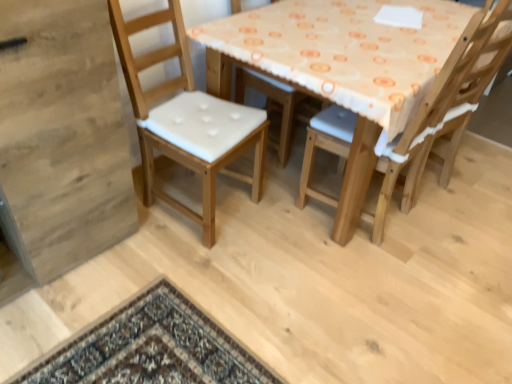
This screenshot has width=512, height=384. What do you see at coordinates (186, 118) in the screenshot? I see `light brown wood chair at left, the first chair when ordered from left to right` at bounding box center [186, 118].

Where is `light brown wood chair at left, the first chair when ordered from left to right`? light brown wood chair at left, the first chair when ordered from left to right is located at coordinates (186, 118).

How much space does light brown wood chair at left, acting as the second chair starting from the right, occupy vertically?

light brown wood chair at left, acting as the second chair starting from the right, is 3.37 feet in height.

How much space does light brown wood chair at left, the first chair when ordered from left to right, occupy horizontally?

The width of light brown wood chair at left, the first chair when ordered from left to right, is 53.26 centimeters.

Locate an element on the screen. This screenshot has height=384, width=512. wooden chair with white cushion at center, acting as the 2th chair starting from the left is located at coordinates (442, 107).

Describe the element at coordinates (442, 107) in the screenshot. I see `wooden chair with white cushion at center, which is counted as the first chair, starting from the right` at that location.

Where is `light brown wood chair at left, acting as the second chair starting from the right`? The image size is (512, 384). light brown wood chair at left, acting as the second chair starting from the right is located at coordinates (186, 118).

Is light brown wood chair at left, the first chair when ordered from left to right, to the left of wooden chair with white cushion at center, acting as the 2th chair starting from the left, from the viewer's perspective?

Yes.

Which object is closer to the camera, light brown wood chair at left, the first chair when ordered from left to right, or wooden chair with white cushion at center, acting as the 2th chair starting from the left?

light brown wood chair at left, the first chair when ordered from left to right, is closer to the camera.

Does point (205, 187) appear closer or farther from the camera than point (436, 133)?

Point (205, 187) appears to be closer to the viewer than point (436, 133).

From the image's perspective, which is below, light brown wood chair at left, the first chair when ordered from left to right, or wooden chair with white cushion at center, which is counted as the first chair, starting from the right?

From the image's view, wooden chair with white cushion at center, which is counted as the first chair, starting from the right, is below.

From a real-world perspective, is light brown wood chair at left, the first chair when ordered from left to right, positioned over wooden chair with white cushion at center, acting as the 2th chair starting from the left, based on gravity?

No, from a real-world perspective, light brown wood chair at left, the first chair when ordered from left to right, is not on top of wooden chair with white cushion at center, acting as the 2th chair starting from the left.

Consider the image. Which of these two, light brown wood chair at left, the first chair when ordered from left to right, or wooden chair with white cushion at center, acting as the 2th chair starting from the left, is wider?

wooden chair with white cushion at center, acting as the 2th chair starting from the left, is wider.

Does light brown wood chair at left, the first chair when ordered from left to right, have a lesser height compared to wooden chair with white cushion at center, acting as the 2th chair starting from the left?

Correct, light brown wood chair at left, the first chair when ordered from left to right, is not as tall as wooden chair with white cushion at center, acting as the 2th chair starting from the left.

Looking at this image, between light brown wood chair at left, the first chair when ordered from left to right, and wooden chair with white cushion at center, acting as the 2th chair starting from the left, which one has smaller size?

wooden chair with white cushion at center, acting as the 2th chair starting from the left.

Is light brown wood chair at left, acting as the second chair starting from the right, surrounding wooden chair with white cushion at center, acting as the 2th chair starting from the left?

No, wooden chair with white cushion at center, acting as the 2th chair starting from the left, is located outside of light brown wood chair at left, acting as the second chair starting from the right.

Does light brown wood chair at left, the first chair when ordered from left to right, touch wooden chair with white cushion at center, acting as the 2th chair starting from the left?

There is a gap between light brown wood chair at left, the first chair when ordered from left to right, and wooden chair with white cushion at center, acting as the 2th chair starting from the left.

Does light brown wood chair at left, the first chair when ordered from left to right, turn towards wooden chair with white cushion at center, acting as the 2th chair starting from the left?

No.

Where is `chair below the light brown wood chair at left, the first chair when ordered from left to right (from the image's perspective)`? The width and height of the screenshot is (512, 384). chair below the light brown wood chair at left, the first chair when ordered from left to right (from the image's perspective) is located at coordinates (442, 107).

Can you confirm if wooden chair with white cushion at center, which is counted as the first chair, starting from the right, is positioned to the left of light brown wood chair at left, the first chair when ordered from left to right?

Incorrect, wooden chair with white cushion at center, which is counted as the first chair, starting from the right, is not on the left side of light brown wood chair at left, the first chair when ordered from left to right.

Considering the relative positions of wooden chair with white cushion at center, which is counted as the first chair, starting from the right, and light brown wood chair at left, the first chair when ordered from left to right, in the image provided, is wooden chair with white cushion at center, which is counted as the first chair, starting from the right, in front of light brown wood chair at left, the first chair when ordered from left to right,?

No, the depth of wooden chair with white cushion at center, which is counted as the first chair, starting from the right, is greater than that of light brown wood chair at left, the first chair when ordered from left to right.

Is point (422, 103) positioned after point (197, 151)?

No, (422, 103) is in front of (197, 151).

From the image's perspective, which object appears higher, wooden chair with white cushion at center, which is counted as the first chair, starting from the right, or light brown wood chair at left, the first chair when ordered from left to right?

light brown wood chair at left, the first chair when ordered from left to right, from the image's perspective.

From a real-world perspective, is wooden chair with white cushion at center, acting as the 2th chair starting from the left, positioned above or below light brown wood chair at left, acting as the second chair starting from the right?

wooden chair with white cushion at center, acting as the 2th chair starting from the left, is situated higher than light brown wood chair at left, acting as the second chair starting from the right, in the real world.

Can you confirm if wooden chair with white cushion at center, acting as the 2th chair starting from the left, is wider than light brown wood chair at left, acting as the second chair starting from the right?

Correct, the width of wooden chair with white cushion at center, acting as the 2th chair starting from the left, exceeds that of light brown wood chair at left, acting as the second chair starting from the right.

From their relative heights in the image, would you say wooden chair with white cushion at center, acting as the 2th chair starting from the left, is taller or shorter than light brown wood chair at left, acting as the second chair starting from the right?

wooden chair with white cushion at center, acting as the 2th chair starting from the left, is taller than light brown wood chair at left, acting as the second chair starting from the right.

Considering the relative sizes of wooden chair with white cushion at center, acting as the 2th chair starting from the left, and light brown wood chair at left, acting as the second chair starting from the right, in the image provided, is wooden chair with white cushion at center, acting as the 2th chair starting from the left, smaller than light brown wood chair at left, acting as the second chair starting from the right,?

Yes.

Is wooden chair with white cushion at center, which is counted as the first chair, starting from the right, situated inside light brown wood chair at left, the first chair when ordered from left to right, or outside?

The correct answer is: outside.

Is wooden chair with white cushion at center, which is counted as the first chair, starting from the right, directly adjacent to light brown wood chair at left, acting as the second chair starting from the right?

No, wooden chair with white cushion at center, which is counted as the first chair, starting from the right, is not with light brown wood chair at left, acting as the second chair starting from the right.

Could you tell me if wooden chair with white cushion at center, acting as the 2th chair starting from the left, is facing light brown wood chair at left, the first chair when ordered from left to right?

No, wooden chair with white cushion at center, acting as the 2th chair starting from the left, is not oriented towards light brown wood chair at left, the first chair when ordered from left to right.

What's the angular difference between wooden chair with white cushion at center, which is counted as the first chair, starting from the right, and light brown wood chair at left, the first chair when ordered from left to right,'s facing directions?

174 degrees.

This screenshot has height=384, width=512. I want to click on chair behind the light brown wood chair at left, the first chair when ordered from left to right, so click(442, 107).

Image resolution: width=512 pixels, height=384 pixels. Identify the location of chair in front of the wooden chair with white cushion at center, which is counted as the first chair, starting from the right. (186, 118).

The width and height of the screenshot is (512, 384). What are the coordinates of `chair above the wooden chair with white cushion at center, which is counted as the first chair, starting from the right (from the image's perspective)` in the screenshot? It's located at (186, 118).